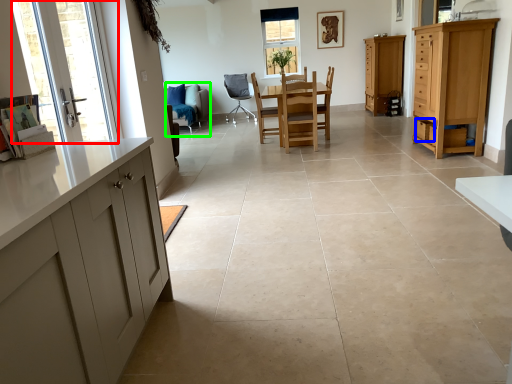
Question: Which object is the farthest from glass door (highlighted by a red box)? Choose among these: drawer (highlighted by a blue box) or chair (highlighted by a green box).

Choices:
 (A) drawer
 (B) chair

Answer: (A)